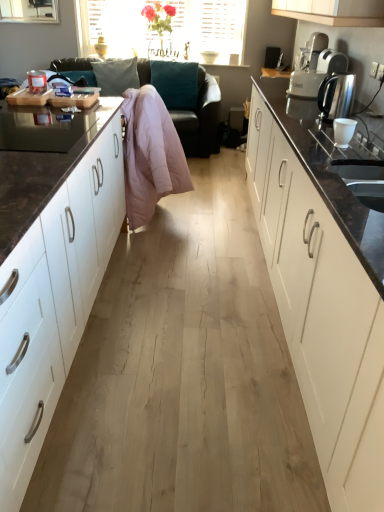
Question: Is white plastic toaster at upper right at the left side of white matte cabinet at left, placed as the 1th cabinetry when sorted from left to right?

Choices:
 (A) yes
 (B) no

Answer: (B)

Question: Is white plastic toaster at upper right next to white matte cabinet at left, placed as the 1th cabinetry when sorted from left to right?

Choices:
 (A) yes
 (B) no

Answer: (B)

Question: Is white plastic toaster at upper right not within white matte cabinet at left, placed as the 1th cabinetry when sorted from left to right?

Choices:
 (A) no
 (B) yes

Answer: (B)

Question: From a real-world perspective, is white plastic toaster at upper right physically above white matte cabinet at left, which ranks as the 2th cabinetry in right-to-left order?

Choices:
 (A) yes
 (B) no

Answer: (A)

Question: Does white plastic toaster at upper right have a lesser width compared to white matte cabinet at left, placed as the 1th cabinetry when sorted from left to right?

Choices:
 (A) yes
 (B) no

Answer: (A)

Question: Considering the positions of translucent glass vase at upper center and teal fabric pillow at upper center in the image, is translucent glass vase at upper center wider or thinner than teal fabric pillow at upper center?

Choices:
 (A) thin
 (B) wide

Answer: (B)

Question: Looking at the image, does translucent glass vase at upper center seem bigger or smaller compared to teal fabric pillow at upper center?

Choices:
 (A) small
 (B) big

Answer: (B)

Question: In the image, is translucent glass vase at upper center on the left side or the right side of teal fabric pillow at upper center?

Choices:
 (A) right
 (B) left

Answer: (B)

Question: From a real-world perspective, relative to teal fabric pillow at upper center, is translucent glass vase at upper center vertically above or below?

Choices:
 (A) below
 (B) above

Answer: (B)

Question: Is white matte cabinet at left, placed as the 1th cabinetry when sorted from left to right, wider or thinner than pink fabric couch at center?

Choices:
 (A) wide
 (B) thin

Answer: (B)

Question: In terms of size, does white matte cabinet at left, which ranks as the 2th cabinetry in right-to-left order, appear bigger or smaller than pink fabric couch at center?

Choices:
 (A) small
 (B) big

Answer: (A)

Question: Considering the positions of point (69, 298) and point (201, 126), is point (69, 298) closer or farther from the camera than point (201, 126)?

Choices:
 (A) closer
 (B) farther

Answer: (A)

Question: From the image's perspective, relative to pink fabric couch at center, is white matte cabinet at left, placed as the 1th cabinetry when sorted from left to right, above or below?

Choices:
 (A) below
 (B) above

Answer: (A)

Question: Based on their positions, is white matte cabinet at left, which ranks as the 2th cabinetry in right-to-left order, located to the left or right of white plastic toaster at upper right?

Choices:
 (A) right
 (B) left

Answer: (B)

Question: Is white matte cabinet at left, which ranks as the 2th cabinetry in right-to-left order, taller or shorter than white plastic toaster at upper right?

Choices:
 (A) tall
 (B) short

Answer: (A)